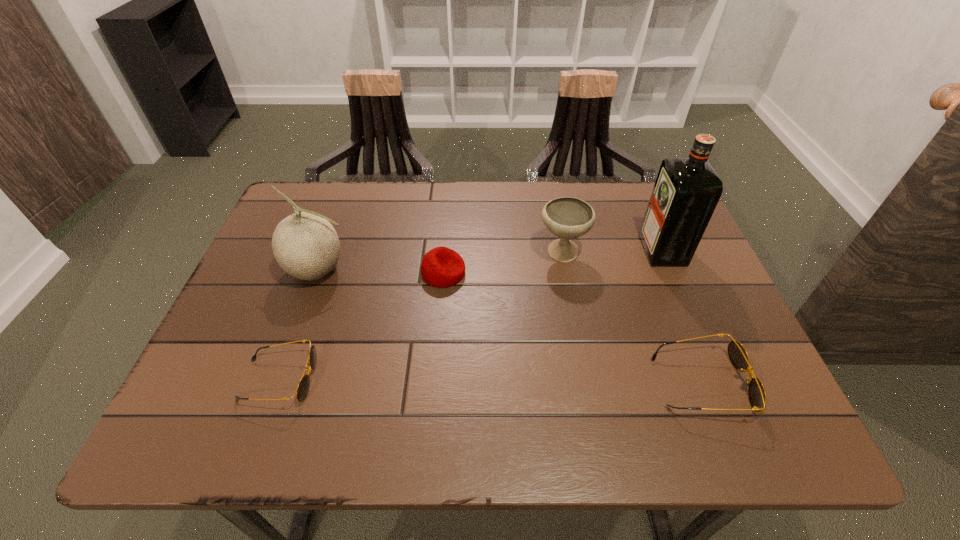
In order to click on the shorter sunglasses in this screenshot , I will do `click(302, 390)`.

In order to click on the shortest object in this screenshot , I will do `click(302, 390)`.

You are a GUI agent. You are given a task and a screenshot of the screen. Output one action in this format:
    pyautogui.click(x=<x>, y=<y>)
    Task: Click on the taller sunglasses
    The image size is (960, 540).
    Given the screenshot: What is the action you would take?
    pyautogui.click(x=737, y=354)

I want to click on the tallest object, so click(686, 192).

Find the location of `the third object from right to left`. the third object from right to left is located at coordinates click(x=566, y=217).

Where is `chalice`? The width and height of the screenshot is (960, 540). chalice is located at coordinates (566, 217).

I want to click on the fourth object from right to left, so click(441, 267).

Identify the location of cantaloup. (305, 245).

Where is `free space located 0.250m on the lenses of the shortest object`? free space located 0.250m on the lenses of the shortest object is located at coordinates (438, 380).

This screenshot has width=960, height=540. What are the coordinates of `free space located on the front label of the liquor` in the screenshot? It's located at (495, 251).